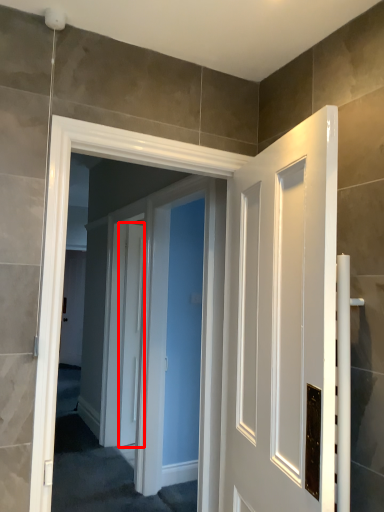
Question: From the image, what is the correct spatial relationship of door (annotated by the red box) in relation to screen door?

Choices:
 (A) right
 (B) left

Answer: (A)